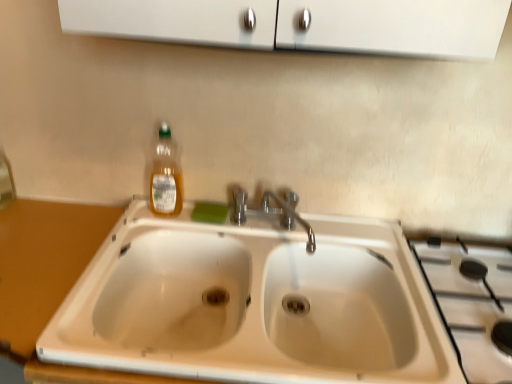
Find the location of a particular element. Image resolution: width=512 pixels, height=384 pixels. vacant space situated on the left part of green sponge at sink is located at coordinates (161, 220).